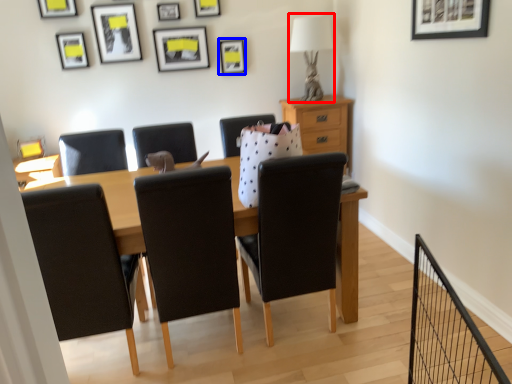
Question: Among these objects, which one is farthest to the camera, table lamp (highlighted by a red box) or picture frame (highlighted by a blue box)?

Choices:
 (A) table lamp
 (B) picture frame

Answer: (B)